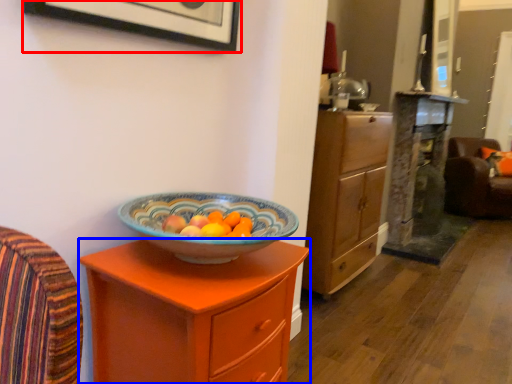
Question: Which object is closer to the camera taking this photo, picture frame (highlighted by a red box) or chest of drawers (highlighted by a blue box)?

Choices:
 (A) picture frame
 (B) chest of drawers

Answer: (A)